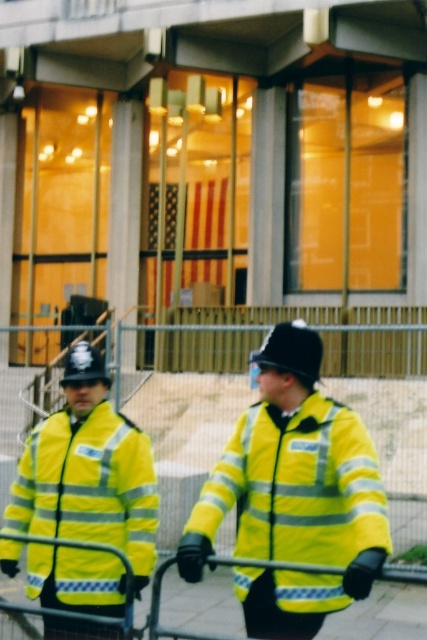
Who is more distant from viewer, [345,410] or [87,486]?

Point [87,486]

Does yellow reflective jacket at center have a larger size compared to yellow reflective jacket at left?

Correct, yellow reflective jacket at center is larger in size than yellow reflective jacket at left.

What do you see at coordinates (298, 484) in the screenshot? This screenshot has width=427, height=640. I see `yellow reflective jacket at center` at bounding box center [298, 484].

Where is `yellow reflective jacket at center`? This screenshot has width=427, height=640. yellow reflective jacket at center is located at coordinates (298, 484).